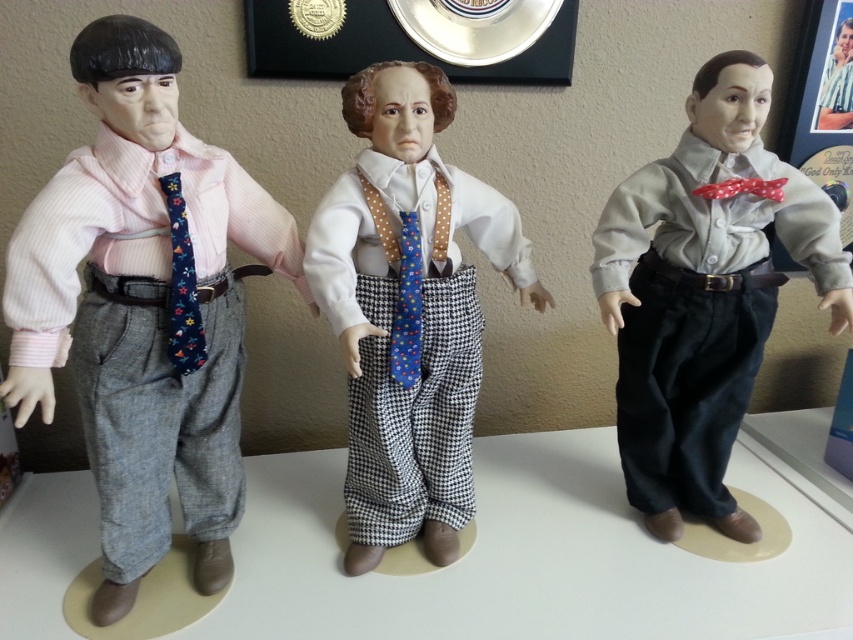
Is point (366, 259) positioned after point (178, 211)?

Yes, it is.

Is polka dot fabric tie at center to the left of floral-patterned fabric tie at center-left from the viewer's perspective?

In fact, polka dot fabric tie at center is to the right of floral-patterned fabric tie at center-left.

Does point (503, 214) come farther from viewer compared to point (184, 364)?

Yes, it is behind point (184, 364).

Where is `polka dot fabric tie at center`? The image size is (853, 640). polka dot fabric tie at center is located at coordinates (421, 310).

Is matte pink shirt at left wider than floral-patterned fabric tie at center-left?

Indeed, matte pink shirt at left has a greater width compared to floral-patterned fabric tie at center-left.

Can you confirm if matte pink shirt at left is smaller than floral-patterned fabric tie at center-left?

Incorrect, matte pink shirt at left is not smaller in size than floral-patterned fabric tie at center-left.

Locate an element on the screen. The height and width of the screenshot is (640, 853). matte pink shirt at left is located at coordinates (143, 308).

Locate an element on the screen. The height and width of the screenshot is (640, 853). matte pink shirt at left is located at coordinates (143, 308).

Is point (612, 227) positioned before point (311, 284)?

No, it is not.

Based on the photo, measure the distance between point (699, 99) and camera.

Point (699, 99) is 4.09 feet away from camera.

At what (x,y) coordinates should I click in order to perform the action: click on matte gray shirt at center. Please return your answer as a coordinate pair (x, y). Looking at the image, I should click on (704, 294).